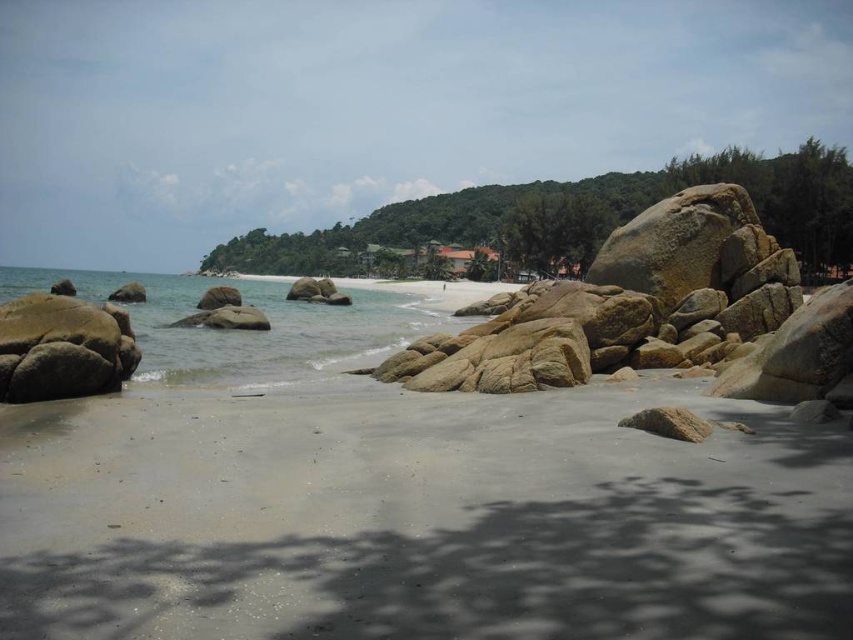
Which of these two, gray sand at lower center or smooth sand at lower left, stands shorter?

gray sand at lower center

Between point (108, 586) and point (310, 320), which one is positioned behind?

The point (310, 320) is more distant.

Image resolution: width=853 pixels, height=640 pixels. Find the location of `gray sand at lower center`. gray sand at lower center is located at coordinates (422, 518).

Does gray sand at lower center have a smaller size compared to smooth granite rocks at center?

Yes, gray sand at lower center is smaller than smooth granite rocks at center.

Is gray sand at lower center closer to the viewer compared to smooth granite rocks at center?

That is True.

Is point (529, 518) positioned in front of point (630, 240)?

Yes, point (529, 518) is in front of point (630, 240).

Locate an element on the screen. Image resolution: width=853 pixels, height=640 pixels. gray sand at lower center is located at coordinates (422, 518).

Does gray sand at lower center have a greater width compared to smooth brown rock at lower left?

Yes.

Find the location of a particular element. gray sand at lower center is located at coordinates (422, 518).

Which is in front, point (727, 580) or point (19, 349)?

Positioned in front is point (727, 580).

The height and width of the screenshot is (640, 853). In order to click on gray sand at lower center in this screenshot , I will do `click(422, 518)`.